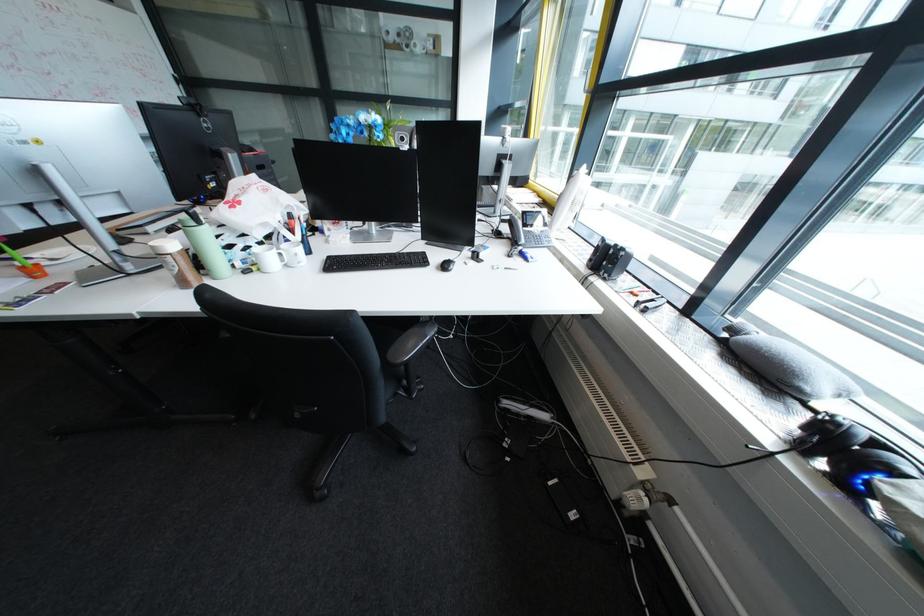
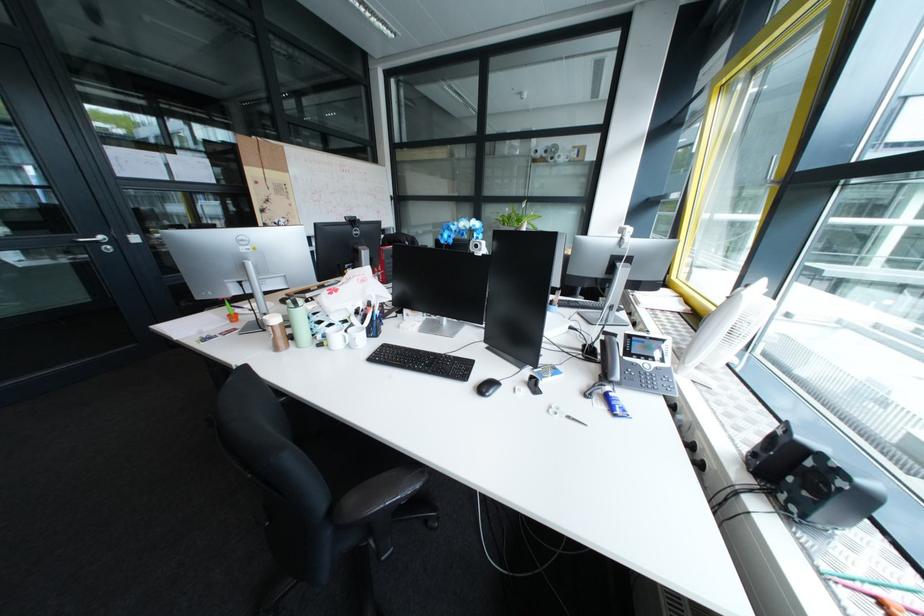
Locate, in the second image, the point that corresponds to (x=187, y=270) in the first image.

(284, 338)